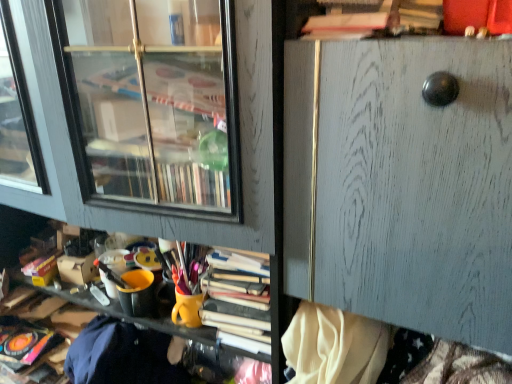
What do you see at coordinates (144, 213) in the screenshot?
I see `wooden shelf at center` at bounding box center [144, 213].

Image resolution: width=512 pixels, height=384 pixels. In order to click on wooden shelf at center in this screenshot , I will do `click(144, 213)`.

This screenshot has height=384, width=512. What do you see at coordinates (402, 184) in the screenshot?
I see `wooden file cabinet at center` at bounding box center [402, 184].

Locate an element on the screen. The image size is (512, 384). wooden file cabinet at center is located at coordinates (402, 184).

The width and height of the screenshot is (512, 384). What are the coordinates of `wooden shelf at center` in the screenshot? It's located at (144, 213).

Does wooden file cabinet at center appear on the right side of wooden shelf at center?

Yes, wooden file cabinet at center is to the right of wooden shelf at center.

Which object is further away from the camera taking this photo, wooden file cabinet at center or wooden shelf at center?

wooden shelf at center.

Which is behind, point (331, 173) or point (247, 91)?

The point (331, 173) is farther from the camera.

From the image's perspective, does wooden file cabinet at center appear lower than wooden shelf at center?

Incorrect, from the image's perspective, wooden file cabinet at center is higher than wooden shelf at center.

From a real-world perspective, between wooden file cabinet at center and wooden shelf at center, who is vertically higher?

wooden file cabinet at center, from a real-world perspective.

Considering the sizes of wooden file cabinet at center and wooden shelf at center in the image, is wooden file cabinet at center wider or thinner than wooden shelf at center?

Considering their sizes, wooden file cabinet at center looks slimmer than wooden shelf at center.

Is wooden file cabinet at center taller than wooden shelf at center?

No.

Considering the relative sizes of wooden file cabinet at center and wooden shelf at center in the image provided, is wooden file cabinet at center smaller than wooden shelf at center?

Indeed, wooden file cabinet at center has a smaller size compared to wooden shelf at center.

Would you say wooden file cabinet at center is outside wooden shelf at center?

wooden file cabinet at center lies outside wooden shelf at center's area.

Are wooden file cabinet at center and wooden shelf at center far apart?

wooden file cabinet at center is near wooden shelf at center, not far away.

Is wooden file cabinet at center oriented towards wooden shelf at center?

No, wooden file cabinet at center is not facing towards wooden shelf at center.

Where is `file cabinet in front of the wooden shelf at center`? Image resolution: width=512 pixels, height=384 pixels. file cabinet in front of the wooden shelf at center is located at coordinates pos(402,184).

Between wooden shelf at center and wooden file cabinet at center, which one appears on the left side from the viewer's perspective?

From the viewer's perspective, wooden shelf at center appears more on the left side.

Is the position of wooden shelf at center less distant than that of wooden file cabinet at center?

No, it is not.

Which is closer to the camera, (252, 75) or (453, 123)?

Clearly, point (252, 75) is more distant from the camera than point (453, 123).

From the image's perspective, which one is positioned higher, wooden shelf at center or wooden file cabinet at center?

wooden file cabinet at center is shown above in the image.

From a real-world perspective, relative to wooden file cabinet at center, is wooden shelf at center vertically above or below?

Clearly, from a real-world perspective, wooden shelf at center is below wooden file cabinet at center.

Considering the sizes of objects wooden shelf at center and wooden file cabinet at center in the image provided, who is thinner, wooden shelf at center or wooden file cabinet at center?

Thinner between the two is wooden file cabinet at center.

Which of these two, wooden shelf at center or wooden file cabinet at center, stands shorter?

wooden file cabinet at center is shorter.

Who is bigger, wooden shelf at center or wooden file cabinet at center?

With larger size is wooden shelf at center.

Could wooden file cabinet at center be considered to be inside wooden shelf at center?

No.

Is the surface of wooden shelf at center in direct contact with wooden file cabinet at center?

There is a gap between wooden shelf at center and wooden file cabinet at center.

Is wooden shelf at center facing towards wooden file cabinet at center?

No, wooden shelf at center does not turn towards wooden file cabinet at center.

How different are the orientations of wooden shelf at center and wooden file cabinet at center in degrees?

0.000169 degrees.

Where is `shelf below the wooden file cabinet at center (from a real-world perspective)`? shelf below the wooden file cabinet at center (from a real-world perspective) is located at coordinates (144, 213).

Where is `shelf located on the left of wooden file cabinet at center`? This screenshot has width=512, height=384. shelf located on the left of wooden file cabinet at center is located at coordinates (144, 213).

This screenshot has height=384, width=512. What are the coordinates of `shelf below the wooden file cabinet at center (from the image's perspective)` in the screenshot? It's located at (144, 213).